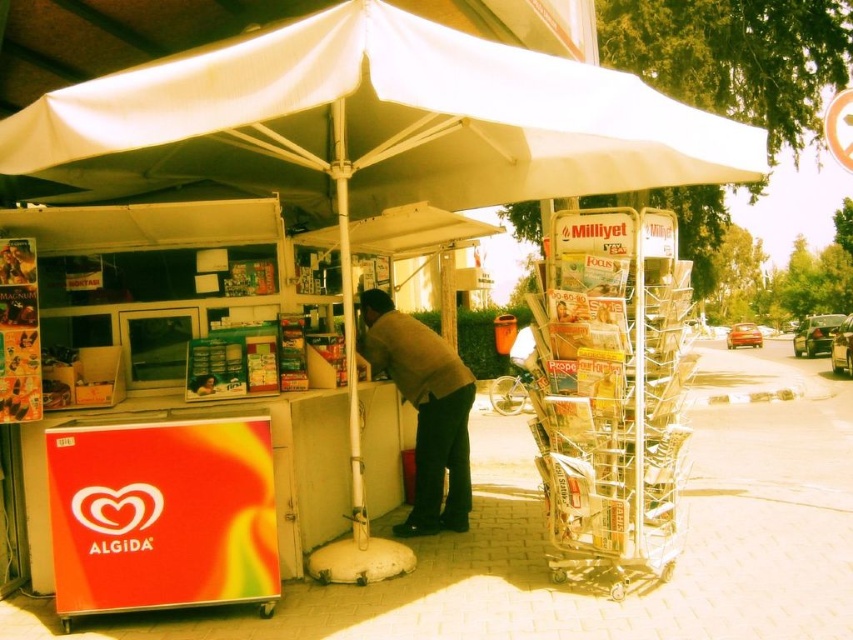
Who is shorter, white fabric canopy at center or brown woolen sweater at center?

With less height is white fabric canopy at center.

Does white fabric canopy at center appear over brown woolen sweater at center?

Yes, white fabric canopy at center is above brown woolen sweater at center.

Between point (115, 180) and point (451, 365), which one is positioned behind?

Point (451, 365)

Identify the location of white fabric canopy at center. (379, 120).

Which is more to the right, white fabric canopy at center or metallic silver magazine rack at right?

metallic silver magazine rack at right is more to the right.

Does white fabric canopy at center appear on the left side of metallic silver magazine rack at right?

Yes, white fabric canopy at center is to the left of metallic silver magazine rack at right.

Describe the element at coordinates (379, 120) in the screenshot. I see `white fabric canopy at center` at that location.

Where is `white fabric canopy at center`? The width and height of the screenshot is (853, 640). white fabric canopy at center is located at coordinates (379, 120).

Measure the distance from metallic silver magazine rack at right to brown woolen sweater at center.

The distance of metallic silver magazine rack at right from brown woolen sweater at center is 4.33 feet.

In the scene shown: Which is above, metallic silver magazine rack at right or brown woolen sweater at center?

metallic silver magazine rack at right is higher up.

This screenshot has height=640, width=853. I want to click on metallic silver magazine rack at right, so click(610, 388).